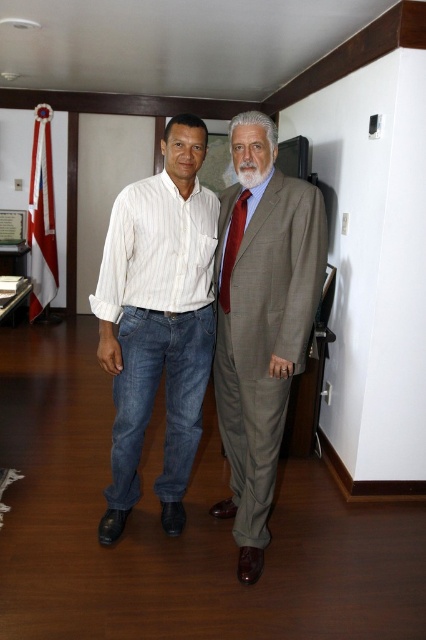
You are a photographer setting up for a formal event. You need to ensure that both the white striped shirt at center and the red silk tie at center are visible in the frame. Based on their positions, which one is closer to the camera?

The white striped shirt at center is in front of the red silk tie at center, so it is closer to the camera.

You are organizing a charity event and need to ensure that all donated clothing items fit into a standard donation box. The white striped shirt at center and the red silk tie at center are being considered. Based on their sizes, which item is more likely to require a larger box?

The white striped shirt at center is bigger than the red silk tie at center, so it would require a larger box.

You are standing in the room and want to move from the point at coordinates point (118, 339) to the point at coordinates point (264, 291). Which direction should you move to reach your destination?

To move from point (118, 339) to point (264, 291), you should move northeast because point (118, 339) is behind point (264, 291).